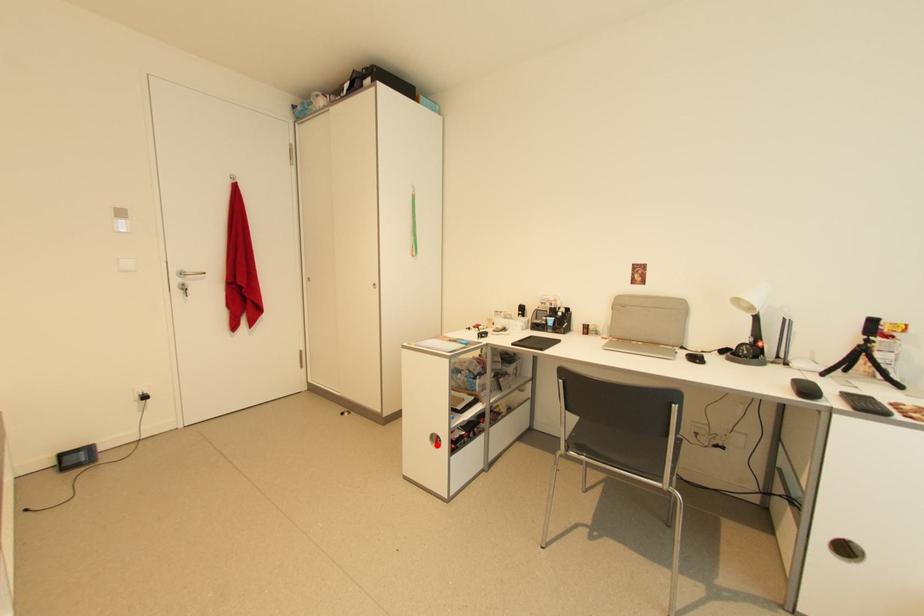
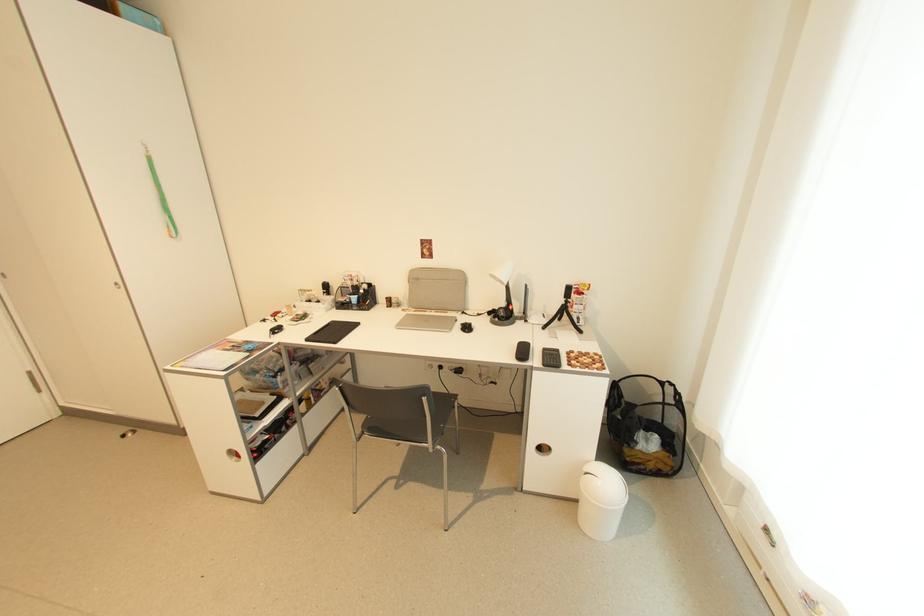
Question: I am providing you with two images of the same scene from different viewpoints. A red point is shown in image1. For the corresponding object point in image2, is it positioned nearer or farther from the camera?

Choices:
 (A) Nearer
 (B) Farther

Answer: (A)